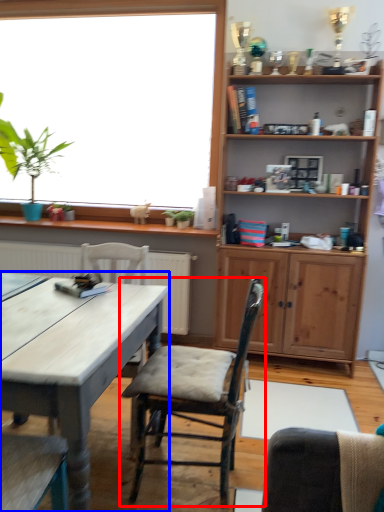
Question: Which object appears closest to the camera in this image, chair (highlighted by a red box) or desk (highlighted by a blue box)?

Choices:
 (A) chair
 (B) desk

Answer: (B)